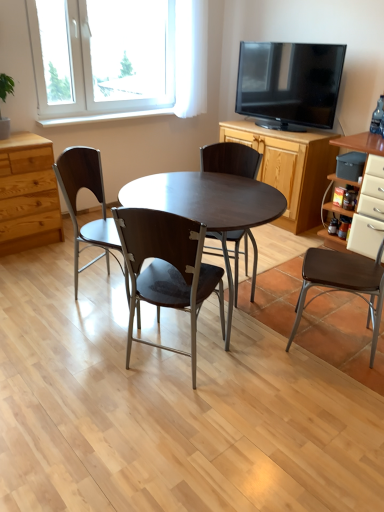
Question: Based on their positions, is white glossy cabinet at right, positioned as the first cabinetry in right-to-left order, located to the left or right of wooden cabinet at center right, which appears as the first cabinetry when viewed from the left?

Choices:
 (A) left
 (B) right

Answer: (B)

Question: From a real-world perspective, is white glossy cabinet at right, positioned as the first cabinetry in right-to-left order, physically located above or below wooden cabinet at center right, which appears as the first cabinetry when viewed from the left?

Choices:
 (A) below
 (B) above

Answer: (B)

Question: Which of these objects is positioned farthest from the transparent glass window at upper left?

Choices:
 (A) matte brown chair at left, acting as the 4th chair starting from the right
 (B) brown leather chair at right, the fourth chair from the left
 (C) matte dark wood table at center
 (D) black glossy tv at upper right
 (E) wooden cabinet at center right, marked as the 2th cabinetry in a right-to-left arrangement

Answer: (B)

Question: Estimate the real-world distances between objects in this image. Which object is farther from the dark brown wood chair at center, which is the 3th chair in left-to-right order?

Choices:
 (A) matte brown chair at center, which is counted as the third chair, starting from the right
 (B) matte brown chair at left, acting as the 4th chair starting from the right
 (C) brown leather chair at right, the first chair from the right
 (D) wooden cabinet at center right, marked as the 2th cabinetry in a right-to-left arrangement
 (E) light brown wood chest of drawers at left

Answer: (E)